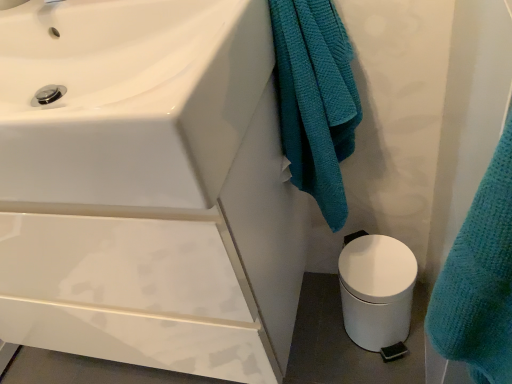
Question: Does white matte trash can at lower right have a larger size compared to white glossy sink at upper left?

Choices:
 (A) no
 (B) yes

Answer: (A)

Question: Is the position of white matte trash can at lower right more distant than that of white glossy sink at upper left?

Choices:
 (A) yes
 (B) no

Answer: (A)

Question: Is there a large distance between white matte trash can at lower right and white glossy sink at upper left?

Choices:
 (A) yes
 (B) no

Answer: (B)

Question: Is white matte trash can at lower right not inside white glossy sink at upper left?

Choices:
 (A) yes
 (B) no

Answer: (A)

Question: Is white matte trash can at lower right in front of white glossy sink at upper left?

Choices:
 (A) yes
 (B) no

Answer: (B)

Question: Does white matte trash can at lower right contain white glossy sink at upper left?

Choices:
 (A) no
 (B) yes

Answer: (A)

Question: Could you tell me if teal textured towel at center is facing white glossy sink at upper left?

Choices:
 (A) no
 (B) yes

Answer: (A)

Question: Is teal textured towel at center behind white glossy sink at upper left?

Choices:
 (A) no
 (B) yes

Answer: (B)

Question: Considering the relative sizes of teal textured towel at center and white glossy sink at upper left in the image provided, is teal textured towel at center smaller than white glossy sink at upper left?

Choices:
 (A) no
 (B) yes

Answer: (B)

Question: Is teal textured towel at center closer to the viewer compared to white glossy sink at upper left?

Choices:
 (A) no
 (B) yes

Answer: (A)

Question: Considering the relative sizes of teal textured towel at center and white glossy sink at upper left in the image provided, is teal textured towel at center taller than white glossy sink at upper left?

Choices:
 (A) yes
 (B) no

Answer: (A)

Question: From a real-world perspective, is teal textured towel at center physically below white glossy sink at upper left?

Choices:
 (A) yes
 (B) no

Answer: (A)

Question: Does white glossy sink at upper left turn towards white matte trash can at lower right?

Choices:
 (A) no
 (B) yes

Answer: (A)